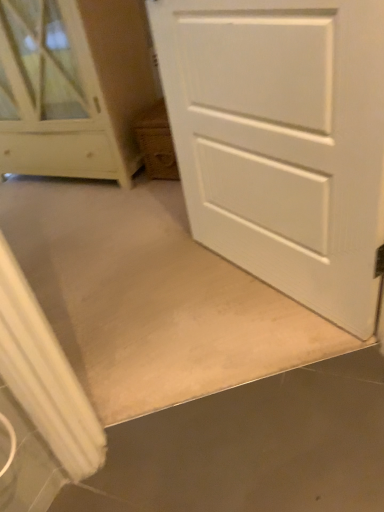
This screenshot has width=384, height=512. I want to click on free location in front of white matte door at center, so click(266, 382).